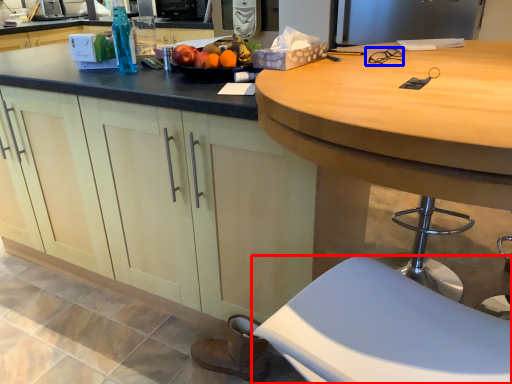
Question: Which object is further to the camera taking this photo, stool (highlighted by a red box) or glasses (highlighted by a blue box)?

Choices:
 (A) stool
 (B) glasses

Answer: (B)